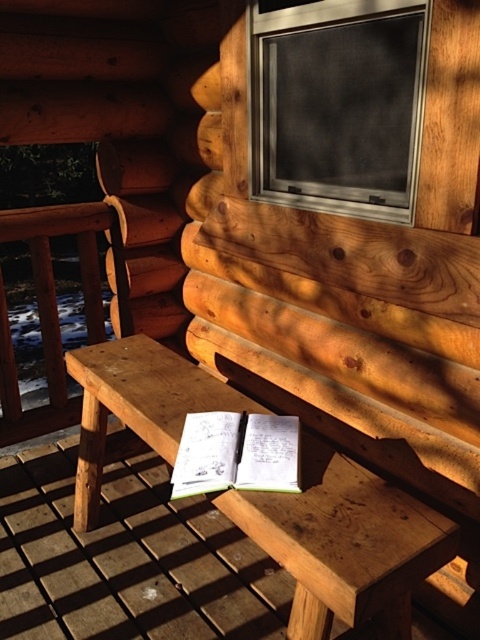
You are standing at the entrance of the log cabin and want to place a new wooden bench on the porch. The existing natural wood picnic table at center is in the way. According to the coordinates provided, can you move the picnic table to the right to make space for the new bench?

The natural wood picnic table at center is located at point (345, 544). Since coordinates are relative, moving it to the right would depend on available space, but the description does not provide enough information about the porch dimensions or surrounding objects to confirm if moving it is feasible.

You are sitting on the wooden bench and want to place your notebook on the natural wood picnic table at center and the metallic mesh window at upper center. Which object is closer to you?

The natural wood picnic table at center is closer to you since it is positioned to the left of the metallic mesh window at upper center, which is further away.